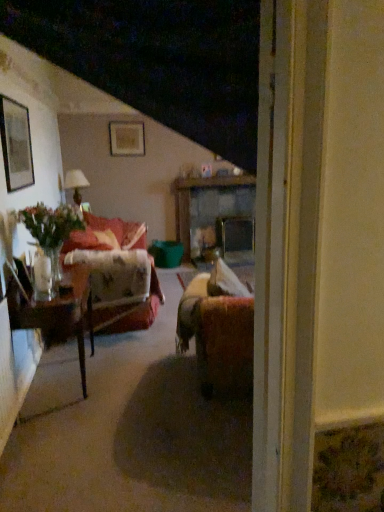
Question: From a real-world perspective, is wooden glossy table at left, which is counted as the first table, starting from the left, positioned under velvet red couch at left based on gravity?

Choices:
 (A) yes
 (B) no

Answer: (A)

Question: Could you tell me if wooden glossy table at left, which is counted as the first table, starting from the left, is facing velvet red couch at left?

Choices:
 (A) yes
 (B) no

Answer: (B)

Question: Is velvet red couch at left at the back of wooden glossy table at left, which is counted as the first table, starting from the left?

Choices:
 (A) yes
 (B) no

Answer: (B)

Question: Can you confirm if wooden glossy table at left, which is the second table in back-to-front order, is smaller than velvet red couch at left?

Choices:
 (A) no
 (B) yes

Answer: (B)

Question: From the image's perspective, would you say wooden glossy table at left, which is the second table in back-to-front order, is shown under velvet red couch at left?

Choices:
 (A) yes
 (B) no

Answer: (A)

Question: Visually, is matte white lampshade at left positioned to the left or to the right of matte black picture frame at upper left, the 2th picture frame from the right?

Choices:
 (A) right
 (B) left

Answer: (B)

Question: From a real-world perspective, is matte white lampshade at left physically located above or below matte black picture frame at upper left, the 1th picture frame positioned from the left?

Choices:
 (A) below
 (B) above

Answer: (A)

Question: From the image's perspective, relative to matte black picture frame at upper left, marked as the 2th picture frame in a back-to-front arrangement, is matte white lampshade at left above or below?

Choices:
 (A) below
 (B) above

Answer: (A)

Question: In terms of size, does matte white lampshade at left appear bigger or smaller than matte black picture frame at upper left, the 1th picture frame positioned from the left?

Choices:
 (A) big
 (B) small

Answer: (A)

Question: From a real-world perspective, is matte gold picture frame at upper center, which is counted as the 1th picture frame, starting from the right, physically located above or below wooden table at center, which appears as the second table when viewed from the front?

Choices:
 (A) above
 (B) below

Answer: (A)

Question: In the image, is matte gold picture frame at upper center, the 2th picture frame when ordered from bottom to top, on the left side or the right side of wooden table at center, which appears as the first table when viewed from the right?

Choices:
 (A) left
 (B) right

Answer: (A)

Question: In terms of width, does matte gold picture frame at upper center, which is counted as the 1th picture frame, starting from the right, look wider or thinner when compared to wooden table at center, which appears as the second table when viewed from the front?

Choices:
 (A) thin
 (B) wide

Answer: (A)

Question: Looking at the image, does matte gold picture frame at upper center, which ranks as the first picture frame in top-to-bottom order, seem bigger or smaller compared to wooden table at center, which appears as the second table when viewed from the front?

Choices:
 (A) big
 (B) small

Answer: (B)

Question: In terms of height, does wooden glossy table at left, the 1th table positioned from the bottom, look taller or shorter compared to wooden table at center, the 2th table in the left-to-right sequence?

Choices:
 (A) tall
 (B) short

Answer: (B)

Question: From a real-world perspective, is wooden glossy table at left, the second table when ordered from top to bottom, positioned above or below wooden table at center, which ranks as the 1th table in back-to-front order?

Choices:
 (A) above
 (B) below

Answer: (B)